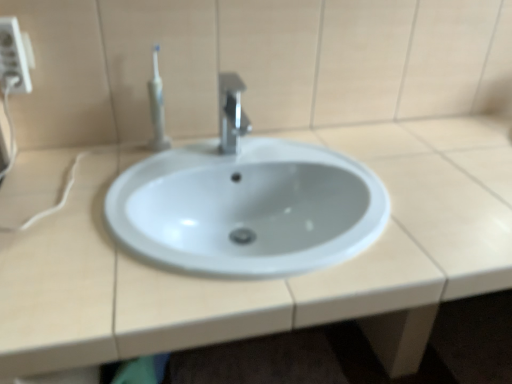
The image size is (512, 384). Identify the location of vacant region to the left of polished metallic faucet at center. (173, 166).